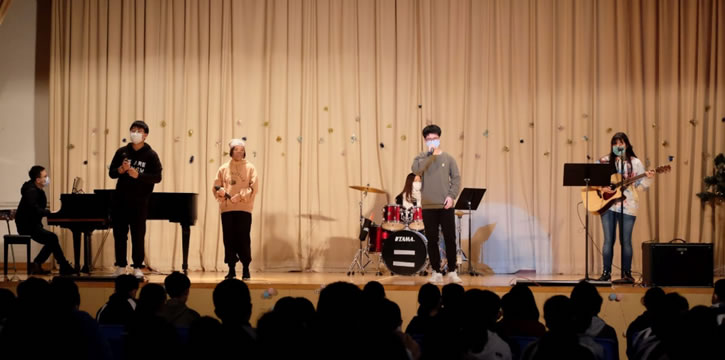
I want to click on background curtain, so click(88, 72), click(278, 115), click(334, 236), click(566, 256), click(658, 43).